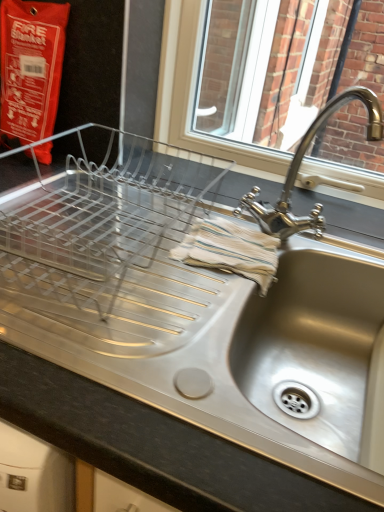
Question: Does polished chrome faucet at upper right have a smaller size compared to satin steel sink at center?

Choices:
 (A) no
 (B) yes

Answer: (B)

Question: Considering the relative positions of polished chrome faucet at upper right and satin steel sink at center in the image provided, is polished chrome faucet at upper right to the left of satin steel sink at center from the viewer's perspective?

Choices:
 (A) yes
 (B) no

Answer: (B)

Question: Is polished chrome faucet at upper right not inside satin steel sink at center?

Choices:
 (A) yes
 (B) no

Answer: (A)

Question: Is polished chrome faucet at upper right further to the viewer compared to satin steel sink at center?

Choices:
 (A) no
 (B) yes

Answer: (B)

Question: Considering the relative sizes of polished chrome faucet at upper right and satin steel sink at center in the image provided, is polished chrome faucet at upper right thinner than satin steel sink at center?

Choices:
 (A) yes
 (B) no

Answer: (A)

Question: From a real-world perspective, is satin steel sink at center above or below polished chrome faucet at upper right?

Choices:
 (A) above
 (B) below

Answer: (B)

Question: Based on their sizes in the image, would you say satin steel sink at center is bigger or smaller than polished chrome faucet at upper right?

Choices:
 (A) small
 (B) big

Answer: (B)

Question: In terms of height, does satin steel sink at center look taller or shorter compared to polished chrome faucet at upper right?

Choices:
 (A) tall
 (B) short

Answer: (A)

Question: Does point (230, 472) appear closer or farther from the camera than point (299, 227)?

Choices:
 (A) farther
 (B) closer

Answer: (B)

Question: From the image's perspective, is polished chrome faucet at upper right above or below satin steel sink at center?

Choices:
 (A) below
 (B) above

Answer: (B)

Question: Is point (309, 214) closer or farther from the camera than point (182, 504)?

Choices:
 (A) closer
 (B) farther

Answer: (B)

Question: From a real-world perspective, is polished chrome faucet at upper right physically located above or below satin steel sink at center?

Choices:
 (A) below
 (B) above

Answer: (B)

Question: Looking at the image, does polished chrome faucet at upper right seem bigger or smaller compared to satin steel sink at center?

Choices:
 (A) small
 (B) big

Answer: (A)

Question: Is stainless steel sink at lower right inside or outside of satin steel sink at center?

Choices:
 (A) outside
 (B) inside

Answer: (B)

Question: In terms of height, does stainless steel sink at lower right look taller or shorter compared to satin steel sink at center?

Choices:
 (A) short
 (B) tall

Answer: (A)